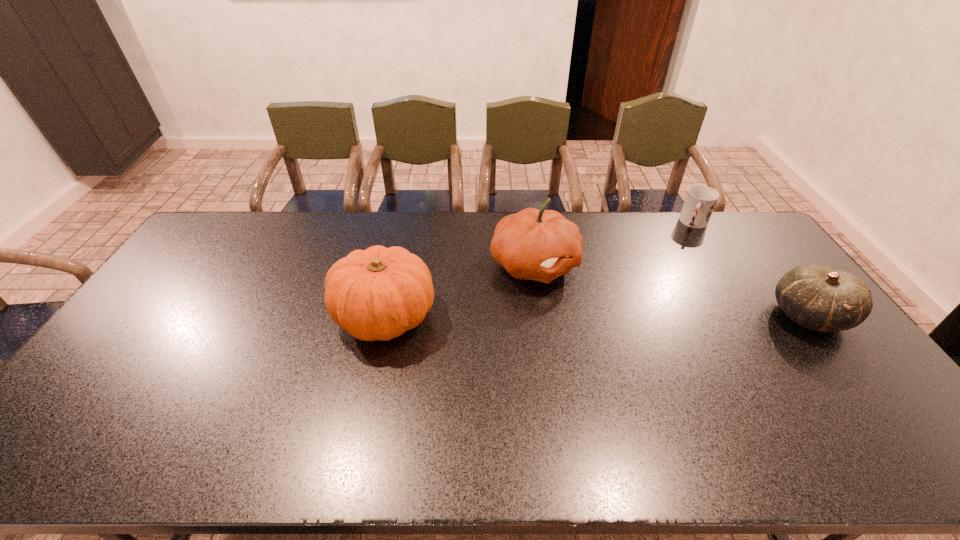
This screenshot has height=540, width=960. I want to click on free space on the desktop that is between the left pumpkin and the gourd and is positioned on the front face of the right pumpkin, so click(660, 316).

Find the location of `free space on the desktop that is between the left pumpkin and the second shortest object and is positioned on the handle side of the cup`. free space on the desktop that is between the left pumpkin and the second shortest object and is positioned on the handle side of the cup is located at coordinates (658, 316).